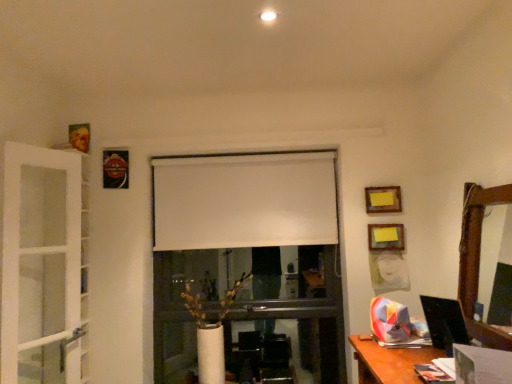
Locate an element on the screen. The height and width of the screenshot is (384, 512). wooden picture frame at upper right, the 3th picture frame positioned from the left is located at coordinates (386, 237).

This screenshot has height=384, width=512. I want to click on matte white picture frame at right, placed as the fourth picture frame when sorted from top to bottom, so click(x=388, y=271).

Measure the distance between yellow paper at upper center, the 3th picture frame when ordered from right to left, and camera.

yellow paper at upper center, the 3th picture frame when ordered from right to left, is 2.46 meters away from camera.

Identify the location of white matte curtain at center. (244, 200).

Describe the element at coordinates (478, 260) in the screenshot. The image size is (512, 384). I see `wooden frame mirror at right` at that location.

The width and height of the screenshot is (512, 384). Describe the element at coordinates (115, 169) in the screenshot. I see `metallic reflective picture frame at upper left, which appears as the 4th picture frame when viewed from the right` at that location.

Find the location of a particular element. This screenshot has width=512, height=384. metallic reflective picture frame at upper left, which appears as the 4th picture frame when viewed from the right is located at coordinates (115, 169).

This screenshot has width=512, height=384. What do you see at coordinates (39, 250) in the screenshot? I see `white glass screen door at left` at bounding box center [39, 250].

Identify the location of wooden picture frame at upper right, which is counted as the 3th picture frame, starting from the top. The width and height of the screenshot is (512, 384). (386, 237).

Is wooden picture frame at upper right, which is counted as the second picture frame, starting from the bottom, further to the viewer compared to matte white picture frame at right, which is the first picture frame in bottom-to-top order?

Yes, wooden picture frame at upper right, which is counted as the second picture frame, starting from the bottom, is further from the camera.

Consider the image. Between wooden picture frame at upper right, the 3th picture frame positioned from the left, and matte white picture frame at right, arranged as the 1th picture frame when viewed from the right, which one has less height?

Standing shorter between the two is wooden picture frame at upper right, the 3th picture frame positioned from the left.

Would you say wooden picture frame at upper right, the 3th picture frame positioned from the left, is inside or outside matte white picture frame at right, the 4th picture frame in the left-to-right sequence?

wooden picture frame at upper right, the 3th picture frame positioned from the left, is not enclosed by matte white picture frame at right, the 4th picture frame in the left-to-right sequence.

Is wooden frame mirror at right far from white matte curtain at center?

wooden frame mirror at right is far away from white matte curtain at center.

The height and width of the screenshot is (384, 512). I want to click on curtain on the left of wooden frame mirror at right, so click(x=244, y=200).

Measure the distance from wooden frame mirror at right to white matte curtain at center.

A distance of 3.87 feet exists between wooden frame mirror at right and white matte curtain at center.

From a real-world perspective, is wooden frame mirror at right below white matte curtain at center?

Yes, from a real-world perspective, wooden frame mirror at right is under white matte curtain at center.

Considering the points (127, 165) and (376, 241), which point is in front, point (127, 165) or point (376, 241)?

The point (376, 241) is in front.

Is wooden picture frame at upper right, the 3th picture frame positioned from the left, completely or partially inside metallic reflective picture frame at upper left, which is the 1th picture frame from left to right?

No, wooden picture frame at upper right, the 3th picture frame positioned from the left, is not surrounded by metallic reflective picture frame at upper left, which is the 1th picture frame from left to right.

From a real-world perspective, is metallic reflective picture frame at upper left, the 1th picture frame positioned from the top, physically located above or below wooden picture frame at upper right, which is the 2th picture frame in right-to-left order?

In terms of real-world spatial position, metallic reflective picture frame at upper left, the 1th picture frame positioned from the top, is above wooden picture frame at upper right, which is the 2th picture frame in right-to-left order.

Who is smaller, metallic reflective picture frame at upper left, which appears as the 4th picture frame when viewed from the right, or wooden picture frame at upper right, the 3th picture frame positioned from the left?

With smaller size is wooden picture frame at upper right, the 3th picture frame positioned from the left.

From the image's perspective, which one is positioned higher, white glass screen door at left or wooden frame mirror at right?

wooden frame mirror at right, from the image's perspective.

How far apart are white glass screen door at left and wooden frame mirror at right?

white glass screen door at left and wooden frame mirror at right are 1.97 meters apart from each other.

From a real-world perspective, who is located lower, white glass screen door at left or wooden frame mirror at right?

From a 3D spatial view, white glass screen door at left is below.

Is white glass screen door at left closer to camera compared to wooden frame mirror at right?

No, white glass screen door at left is behind wooden frame mirror at right.

Between wooden picture frame at upper right, the 3th picture frame positioned from the left, and metallic reflective picture frame at upper left, the fourth picture frame in the bottom-to-top sequence, which one is positioned behind?

metallic reflective picture frame at upper left, the fourth picture frame in the bottom-to-top sequence, is further from the camera.

Is wooden picture frame at upper right, the 3th picture frame positioned from the left, far from metallic reflective picture frame at upper left, which appears as the 4th picture frame when viewed from the right?

Yes, wooden picture frame at upper right, the 3th picture frame positioned from the left, and metallic reflective picture frame at upper left, which appears as the 4th picture frame when viewed from the right, are located far from each other.

From a real-world perspective, between wooden picture frame at upper right, the 3th picture frame positioned from the left, and metallic reflective picture frame at upper left, which is the 1th picture frame from left to right, who is vertically higher?

metallic reflective picture frame at upper left, which is the 1th picture frame from left to right.

Do you think wooden frame mirror at right is within white glass screen door at left, or outside of it?

The correct answer is: outside.

The image size is (512, 384). Identify the location of screen door that is under the wooden frame mirror at right (from a real-world perspective). (39, 250).

Is wooden frame mirror at right aimed at white glass screen door at left?

Yes, wooden frame mirror at right is facing white glass screen door at left.

From a real-world perspective, which is physically below, wooden picture frame at upper right, which is counted as the second picture frame, starting from the bottom, or wooden frame mirror at right?

From a 3D spatial view, wooden frame mirror at right is below.

Can you tell me how much wooden picture frame at upper right, the 3th picture frame positioned from the left, and wooden frame mirror at right differ in facing direction?

90 degrees separate the facing orientations of wooden picture frame at upper right, the 3th picture frame positioned from the left, and wooden frame mirror at right.

This screenshot has width=512, height=384. What are the coordinates of `the 2nd picture frame to the left when counting from the wooden frame mirror at right` in the screenshot? It's located at (386, 237).

Considering the points (384, 248) and (476, 298), which point is in front, point (384, 248) or point (476, 298)?

The point (476, 298) is closer.

The height and width of the screenshot is (384, 512). In order to click on picture frame in front of the wooden picture frame at upper right, which is counted as the 3th picture frame, starting from the top in this screenshot , I will do `click(388, 271)`.

The height and width of the screenshot is (384, 512). What are the coordinates of `curtain above the wooden frame mirror at right (from the image's perspective)` in the screenshot? It's located at (244, 200).

Based on their spatial positions, is white glass screen door at left or matte white picture frame at right, which is the first picture frame in bottom-to-top order, closer to yellow paper at upper center, the 3th picture frame when ordered from right to left?

matte white picture frame at right, which is the first picture frame in bottom-to-top order, is closer to yellow paper at upper center, the 3th picture frame when ordered from right to left.

Estimate the real-world distances between objects in this image. Which object is closer to yellow paper at upper center, which ranks as the 2th picture frame in left-to-right order, metallic reflective picture frame at upper left, which appears as the 4th picture frame when viewed from the right, or white glass screen door at left?

metallic reflective picture frame at upper left, which appears as the 4th picture frame when viewed from the right.

Based on the photo, based on their spatial positions, is wooden picture frame at upper right, which is counted as the 3th picture frame, starting from the top, or white glass screen door at left further from yellow paper at upper center, the 2th picture frame when ordered from top to bottom?

white glass screen door at left.

Based on their spatial positions, is yellow paper at upper center, which ranks as the 2th picture frame in left-to-right order, or white matte curtain at center further from white glass screen door at left?

Among the two, yellow paper at upper center, which ranks as the 2th picture frame in left-to-right order, is located further to white glass screen door at left.

From the image, which object appears to be nearer to matte white picture frame at right, the 4th picture frame in the left-to-right sequence, yellow paper at upper center, which ranks as the 2th picture frame in left-to-right order, or white matte curtain at center?

yellow paper at upper center, which ranks as the 2th picture frame in left-to-right order.

When comparing their distances from yellow paper at upper center, the 3th picture frame when ordered from right to left, does white matte curtain at center or wooden picture frame at upper right, which is counted as the second picture frame, starting from the bottom, seem closer?

wooden picture frame at upper right, which is counted as the second picture frame, starting from the bottom, is closer to yellow paper at upper center, the 3th picture frame when ordered from right to left.

Which object lies further to the anchor point white matte curtain at center, wooden picture frame at upper right, which is the 2th picture frame in right-to-left order, or yellow paper at upper center, which is the third picture frame in bottom-to-top order?

wooden picture frame at upper right, which is the 2th picture frame in right-to-left order, lies further to white matte curtain at center than the other object.

Based on their spatial positions, is wooden frame mirror at right or white matte curtain at center further from matte white picture frame at right, placed as the fourth picture frame when sorted from top to bottom?

white matte curtain at center is positioned further to the anchor matte white picture frame at right, placed as the fourth picture frame when sorted from top to bottom.

The width and height of the screenshot is (512, 384). I want to click on curtain located between white glass screen door at left and matte white picture frame at right, arranged as the 1th picture frame when viewed from the right, in the left-right direction, so click(x=244, y=200).

I want to click on picture frame between yellow paper at upper center, the 3th picture frame when ordered from right to left, and matte white picture frame at right, the 4th picture frame in the left-to-right sequence, in the up-down direction, so click(x=386, y=237).

Locate an element on the screen. Image resolution: width=512 pixels, height=384 pixels. picture frame situated between white glass screen door at left and yellow paper at upper center, the 3th picture frame when ordered from right to left, from left to right is located at coordinates (115, 169).

Locate an element on the screen. curtain between white glass screen door at left and yellow paper at upper center, the 3th picture frame when ordered from right to left, in the horizontal direction is located at coordinates (244, 200).